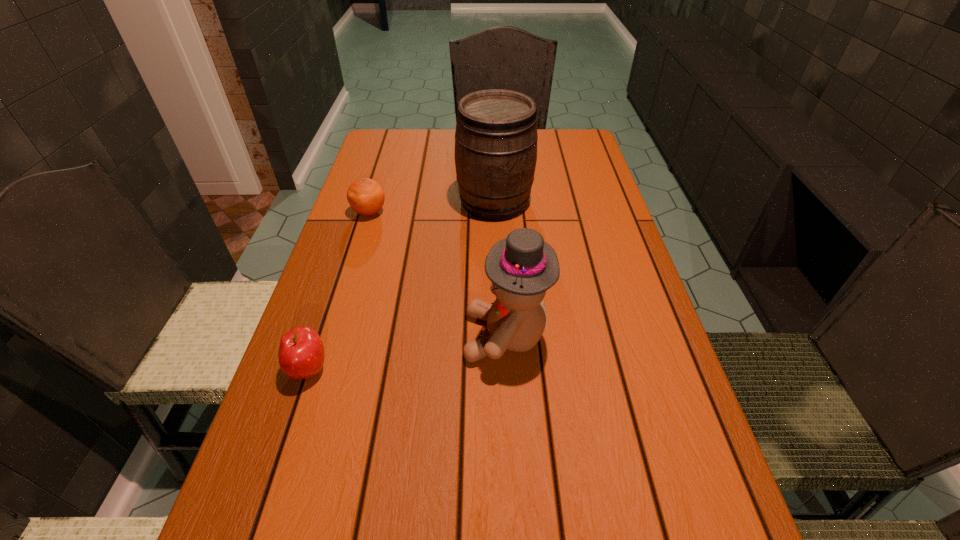
The width and height of the screenshot is (960, 540). What are the coordinates of `orange that is at the left edge` in the screenshot? It's located at (366, 197).

Locate an element on the screen. The image size is (960, 540). apple that is at the left edge is located at coordinates (301, 354).

In the image, there is a desktop. At what (x,y) coordinates should I click in order to perform the action: click on vacant space at the left edge. Please return your answer as a coordinate pair (x, y). Image resolution: width=960 pixels, height=540 pixels. Looking at the image, I should click on (402, 176).

Locate an element on the screen. The width and height of the screenshot is (960, 540). blank area at the right edge is located at coordinates (595, 169).

In the image, there is a desktop. What are the coordinates of `vacant space at the far left corner` in the screenshot? It's located at (413, 153).

The height and width of the screenshot is (540, 960). I want to click on vacant space at the far right corner, so click(584, 146).

Where is `free space between the wine bucket and the apple`? This screenshot has width=960, height=540. free space between the wine bucket and the apple is located at coordinates (401, 285).

You are a GUI agent. You are given a task and a screenshot of the screen. Output one action in this format:
    pyautogui.click(x=<x>, y=<y>)
    Task: Click on the free area in between the apple and the orange
    The width and height of the screenshot is (960, 540).
    Given the screenshot: What is the action you would take?
    pyautogui.click(x=339, y=291)

The height and width of the screenshot is (540, 960). Identify the location of vacant area between the wine bucket and the apple. (401, 285).

What are the coordinates of `free point between the orange and the rag_doll` in the screenshot? It's located at (438, 274).